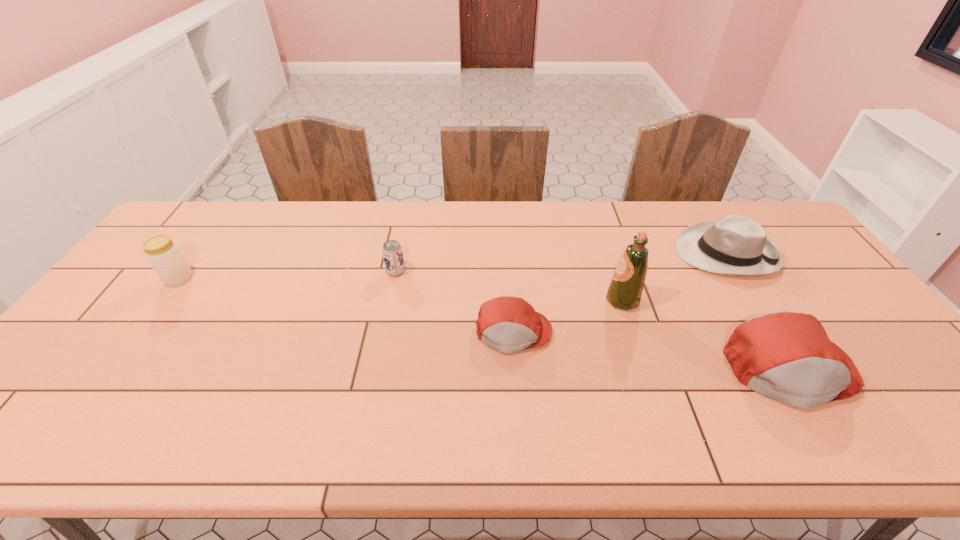
This screenshot has width=960, height=540. Identify the location of cap present at the right edge. (787, 356).

The height and width of the screenshot is (540, 960). I want to click on fedora at the right edge, so click(736, 245).

Where is `object present at the far right corner`? The width and height of the screenshot is (960, 540). object present at the far right corner is located at coordinates (736, 245).

The image size is (960, 540). What are the coordinates of `object positioned at the near right corner` in the screenshot? It's located at (787, 356).

The height and width of the screenshot is (540, 960). I want to click on free region at the far edge of the desktop, so click(334, 202).

The height and width of the screenshot is (540, 960). I want to click on vacant space at the near edge, so click(x=691, y=404).

Locate an element on the screen. vacant space at the right edge is located at coordinates (829, 321).

Identify the location of vacant region at the far left corner of the desktop. This screenshot has width=960, height=540. (167, 235).

Identify the location of blank space at the far right corner. (782, 234).

Locate an element on the screen. The width and height of the screenshot is (960, 540). vacant space at the near right corner is located at coordinates (936, 406).